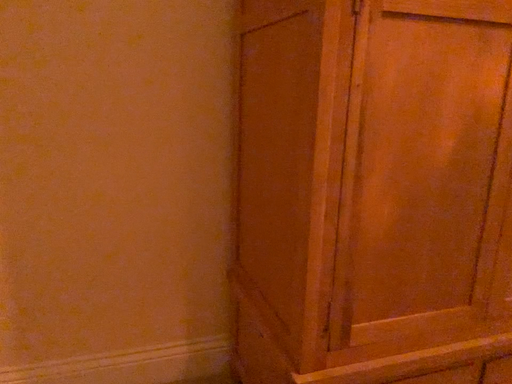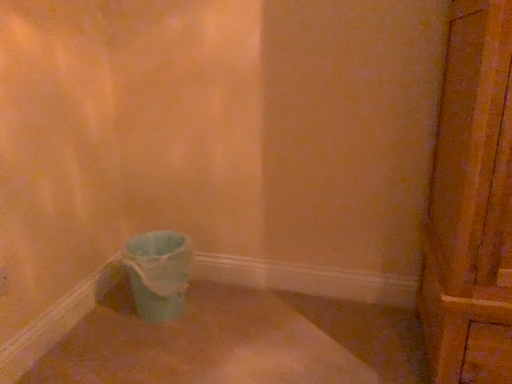
Question: How did the camera likely rotate when shooting the video?

Choices:
 (A) rotated right
 (B) rotated left

Answer: (B)